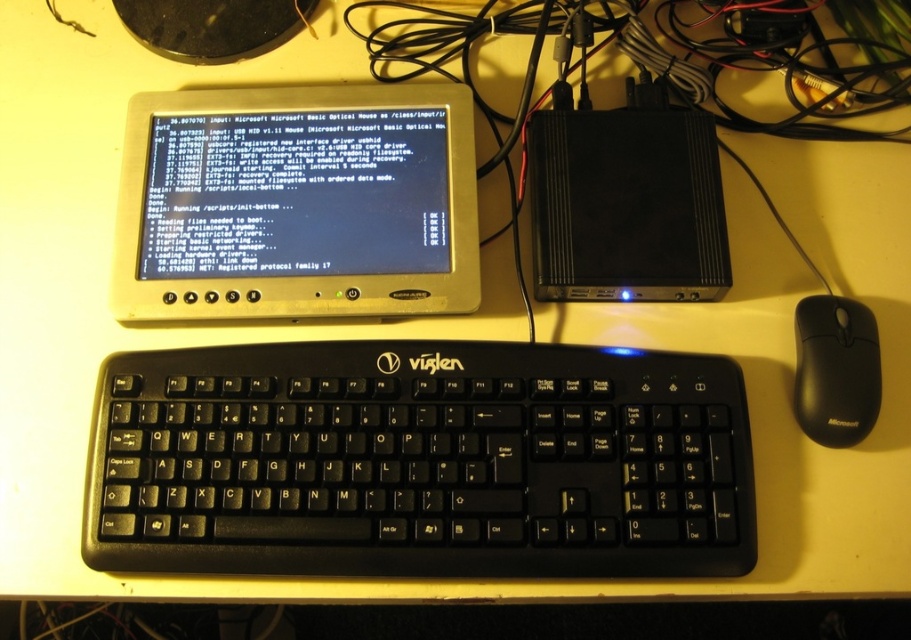
From the picture: You are sitting at a desk and want to reach for the black plastic keyboard at center and the metallic silver monitor at center. Which object is closer to your hand?

The black plastic keyboard at center is closer to the viewer than the metallic silver monitor at center, so the keyboard is closer to your hand.

You are a technician trying to connect a new cable to the black plastic keyboard at center. The cable you have is 1 meter long. The nearest available port is located at point 0.5, 0.5. Can you reach the port with the cable?

The black plastic keyboard at center is located at point (420, 461). The distance between the keyboard and the port at (455, 320) would require a cable longer than 1 meter to reach, so the cable is insufficient.

You are setting up a new workspace and want to place a small decorative item between the metallic silver monitor at center and the black plastic mouse at lower right. Based on their sizes, which object should you place closer to the edge of the desk to ensure the decorative item fits comfortably?

The metallic silver monitor at center is wider than the black plastic mouse at lower right. To ensure the decorative item fits comfortably between them, place the wider monitor closer to the edge of the desk so there is enough space for the mouse and the decorative item.